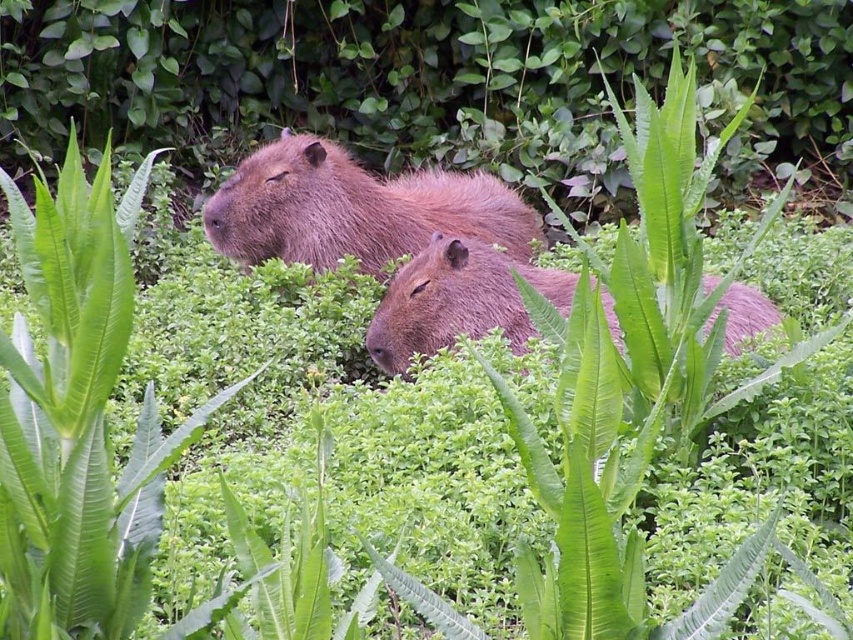
Who is positioned more to the right, brown furry capybara at center or fuzzy brown capybara at center?

Positioned to the right is fuzzy brown capybara at center.

Can you confirm if brown furry capybara at center is shorter than fuzzy brown capybara at center?

No.

Who is more distant from viewer, (x=282, y=244) or (x=611, y=332)?

The point (x=282, y=244) is more distant.

The image size is (853, 640). I want to click on brown furry capybara at center, so click(x=354, y=209).